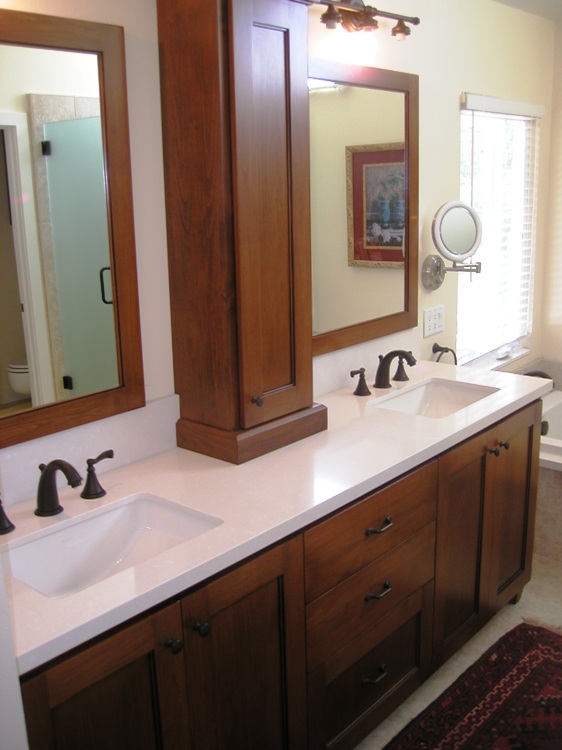
Locate an element on the screen. outlet is located at coordinates (430, 322).